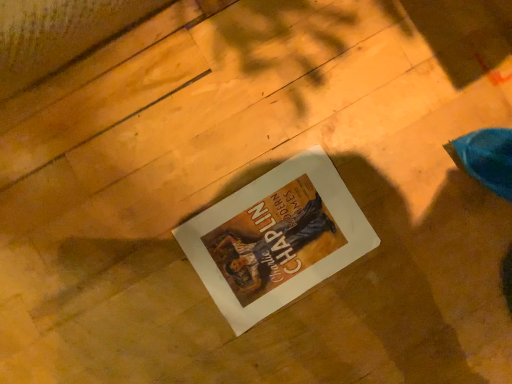
This screenshot has width=512, height=384. Identify the location of free point to the left of matte paper poster at center. (177, 164).